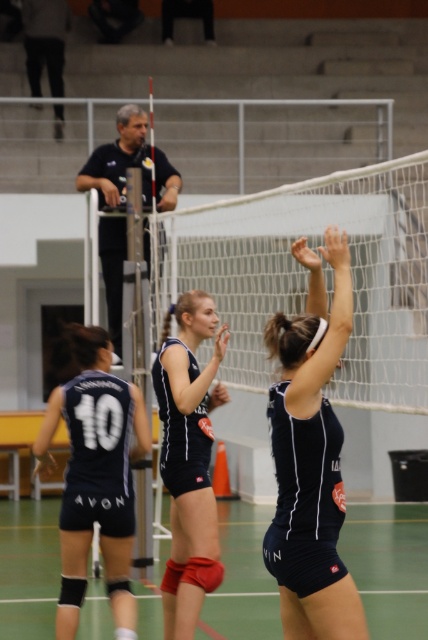
You are a referee in a volleyball match. You need to determine if the matte black shorts at center are wider than the matte blue jersey at center. Based on the scene, what is your observation?

The matte black shorts at center has a lesser width compared to matte blue jersey at center, so the matte black shorts at center are not wider than the matte blue jersey at center.

You are a referee in a volleyball match. You need to determine if the matte black shorts at center are within the court boundaries. The court is a rectangle with corners at coordinates A1, B1, C1, D1. Can you confirm if the shorts are inside the court?

The matte black shorts at center are located at point coordinates (389, 566). To confirm if they are within the court boundaries, the referee should compare these coordinates with the court corners A1, B1, C1, D1. If the point lies within the rectangle formed by these corners, then the shorts are inside the court.